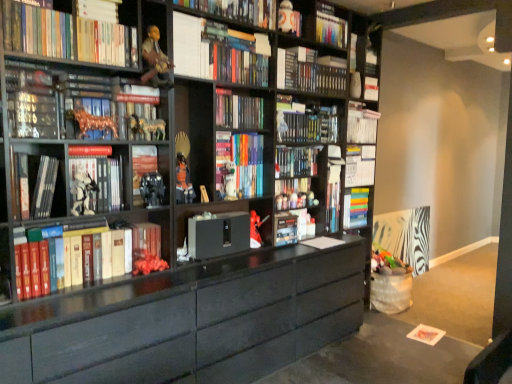
Question: From the image's perspective, is multicolored bookshelf at upper center located above or below matte black cabinet at center?

Choices:
 (A) above
 (B) below

Answer: (A)

Question: Looking at the image, does multicolored bookshelf at upper center seem bigger or smaller compared to matte black cabinet at center?

Choices:
 (A) small
 (B) big

Answer: (A)

Question: Considering the real-world distances, which object is farthest from the white matte book at upper right, the thirteenth book when ordered from bottom to top?

Choices:
 (A) metallic gold horse at upper left, marked as the 2th toy in a left-to-right arrangement
 (B) matte black bookshelf at center, which is counted as the sixth book, starting from the bottom
 (C) metallic black robot at center, which ranks as the 3th toy in front-to-back order
 (D) hardcover book at left, the eleventh book in the top-to-bottom sequence
 (E) matte black figurine at center, placed as the fourth toy when sorted from top to bottom

Answer: (D)

Question: Which is farther from the metallic black robot at center, arranged as the fourth toy when viewed from the left?

Choices:
 (A) white plastic toy at upper center, which is the first toy in back-to-front order
 (B) hardcover books at left, the fourteenth book positioned from the top
 (C) metallic gold horse at upper left, the fourth toy from the bottom
 (D) white glossy book at upper left, which is the twelfth book in bottom-to-top order
 (E) hardcover book at upper center, placed as the fourth book when sorted from top to bottom

Answer: (A)